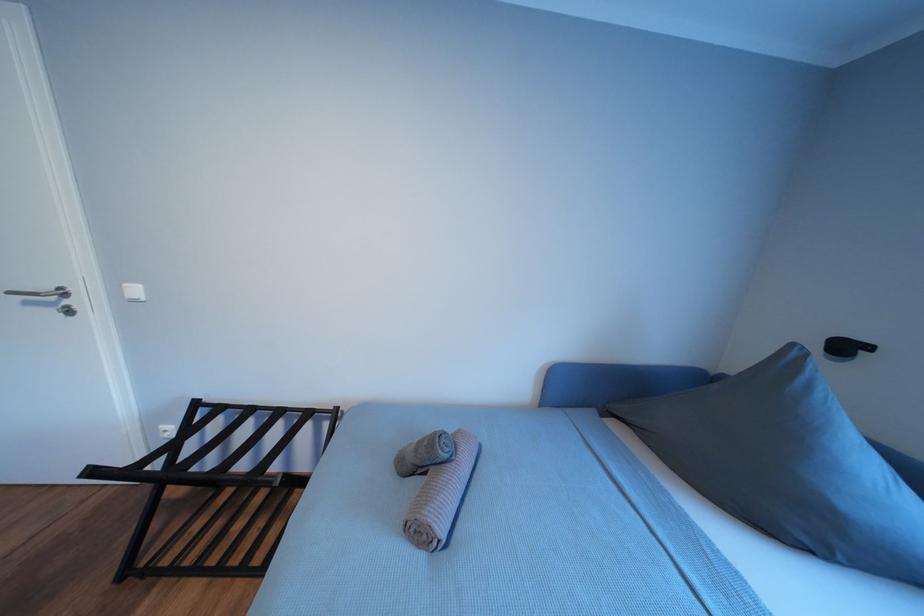
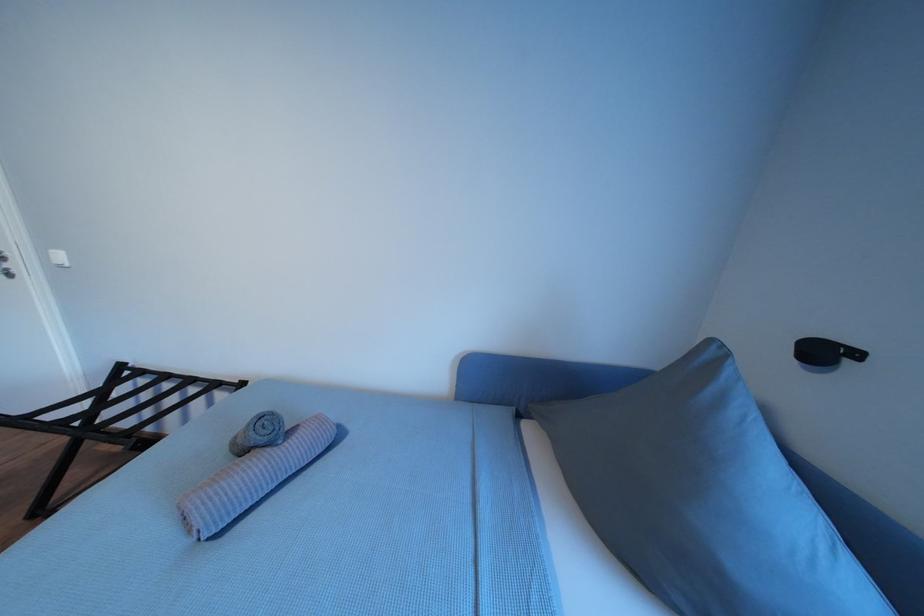
Question: The camera is either moving clockwise (left) or counter-clockwise (right) around the object. The first image is from the beginning of the video and the second image is from the end. Is the camera moving left or right when shooting the video?

Choices:
 (A) Left
 (B) Right

Answer: (B)